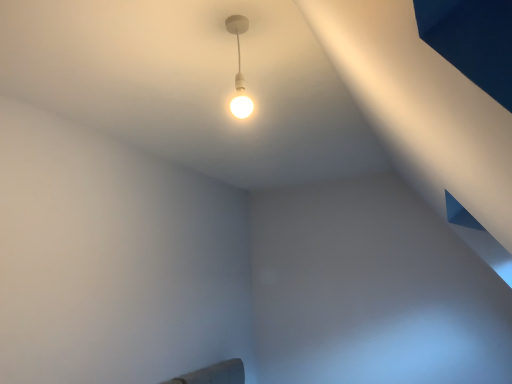
Where is `matte white bulb at center`? The image size is (512, 384). matte white bulb at center is located at coordinates (239, 70).

What do you see at coordinates (239, 70) in the screenshot? The height and width of the screenshot is (384, 512). I see `matte white bulb at center` at bounding box center [239, 70].

Identify the location of matte white bulb at center. (239, 70).